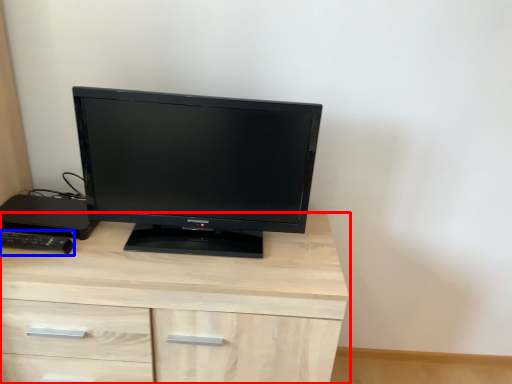
Question: Among these objects, which one is farthest to the camera, chest of drawers (highlighted by a red box) or desktop (highlighted by a blue box)?

Choices:
 (A) chest of drawers
 (B) desktop

Answer: (B)